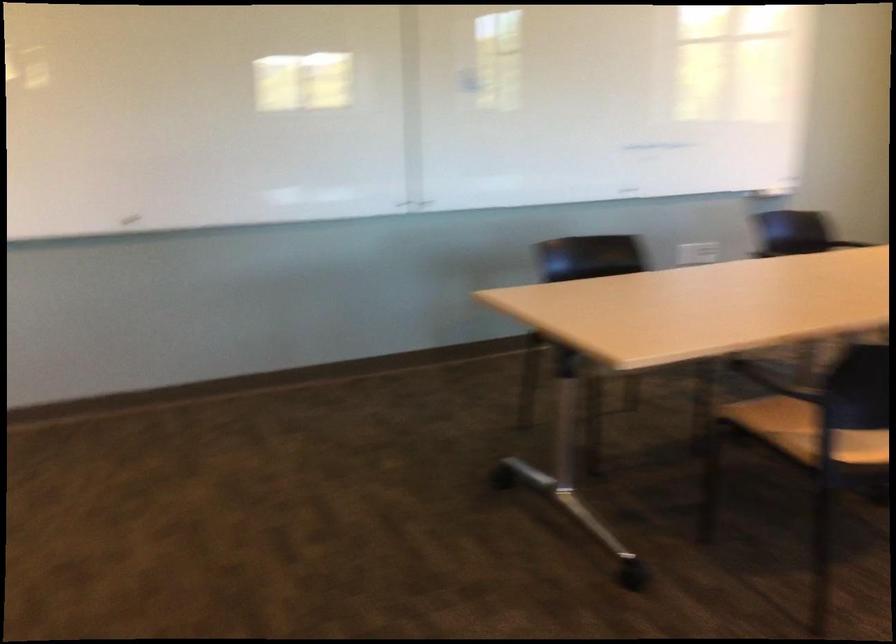
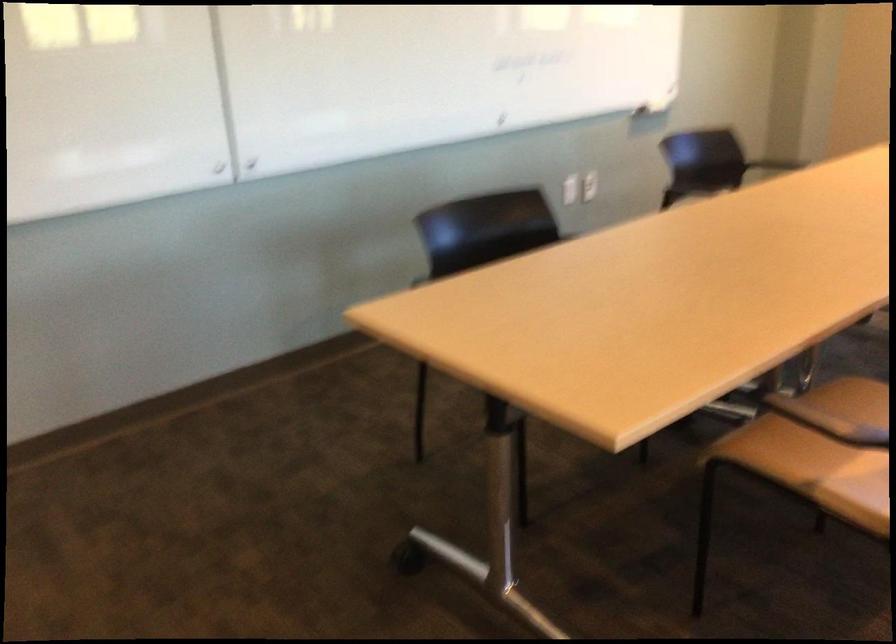
Question: The images are taken continuously from a first-person perspective. In which direction are you moving?

Choices:
 (A) Left
 (B) Right
 (C) Forward
 (D) Backward

Answer: (C)